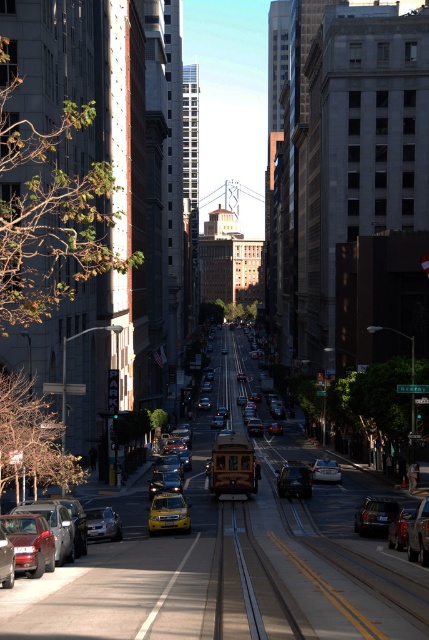
You are a delivery driver trying to park your truck between the matte red car at lower left and the shiny silver sedan at lower left. Your truck is 2 meters wide. Can you fit your truck between them?

The matte red car at lower left might be wider than the shiny silver sedan at lower left, so there might not be enough space for the truck to fit between them. You should check the distance before attempting to park.

You are a delivery driver needing to park your vehicle in a tight space between the matte red car at lower left and the metallic silver taxi at center. Given that your delivery van is 5 meters long, can you fit it between them?

The matte red car at lower left is bigger than the metallic silver taxi at center, but the description does not provide the exact distance between them. Without knowing the space between the two vehicles, it is impossible to determine if the 5 meter delivery van can fit.